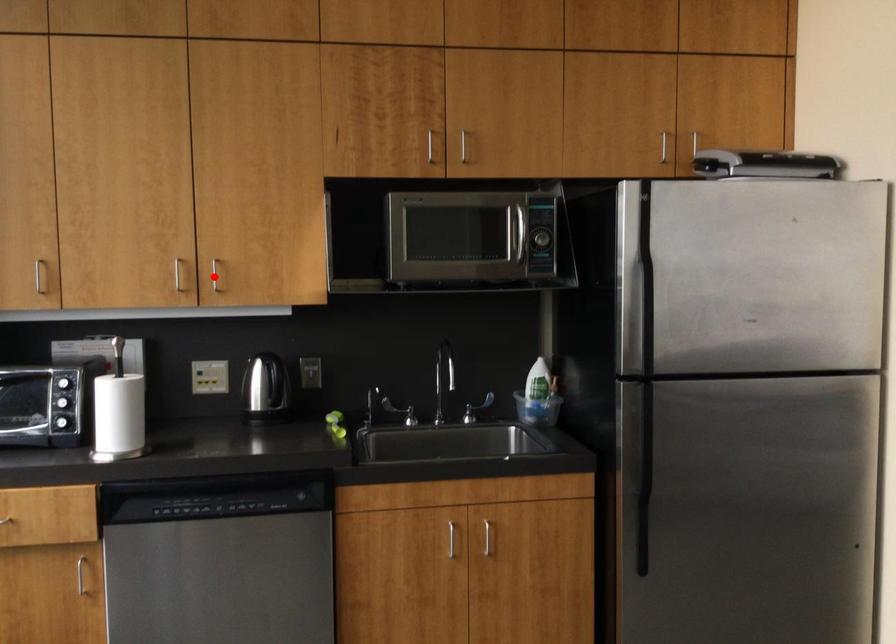
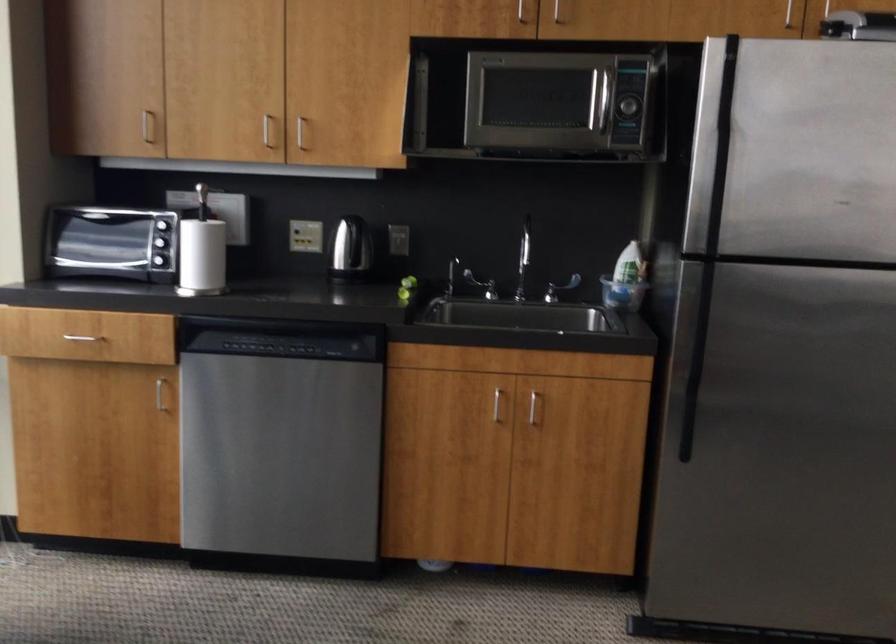
Question: I am providing you with two images of the same scene from different viewpoints. A red point is marked on the first image. Can you still see the location of the red point in image 2?

Choices:
 (A) Yes
 (B) No

Answer: (A)